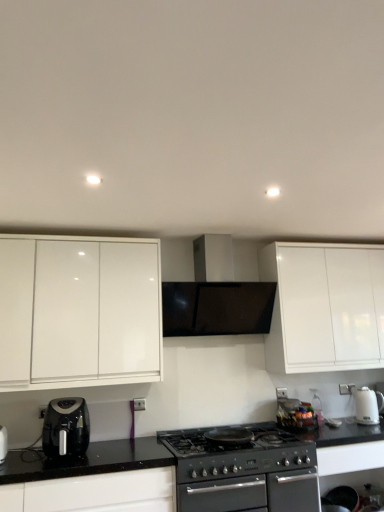
What do you see at coordinates (367, 405) in the screenshot?
I see `white glossy electric kettle at right, which ranks as the first kitchen appliance in back-to-front order` at bounding box center [367, 405].

Identify the location of black plastic air fryer at lower left, marked as the first kitchen appliance in a front-to-back arrangement. The image size is (384, 512). (66, 426).

The height and width of the screenshot is (512, 384). I want to click on black granite countertop at lower left, so click(x=86, y=460).

What do you see at coordinates (215, 298) in the screenshot?
I see `black matte range hood at center` at bounding box center [215, 298].

The width and height of the screenshot is (384, 512). Identify the location of white glossy cabinet at left. (79, 312).

From a real-world perspective, who is located lower, white glossy cabinet at left or black matte stove at center?

black matte stove at center, from a real-world perspective.

Is white glossy cabinet at left positioned beyond the bounds of black matte stove at center?

Absolutely, white glossy cabinet at left is external to black matte stove at center.

Considering the relative positions of white glossy cabinet at left and black matte stove at center in the image provided, is white glossy cabinet at left to the left of black matte stove at center from the viewer's perspective?

Indeed, white glossy cabinet at left is positioned on the left side of black matte stove at center.

Is black matte range hood at center completely or partially outside of white glossy cabinet at left?

Yes, black matte range hood at center is outside of white glossy cabinet at left.

In the scene shown: From the image's perspective, is black matte range hood at center on white glossy cabinet at left?

Yes, from the image's perspective, black matte range hood at center is on top of white glossy cabinet at left.

Are black matte range hood at center and white glossy cabinet at left located far from each other?

No.

How far apart are black matte range hood at center and white glossy cabinet at left?

black matte range hood at center is 23.02 inches from white glossy cabinet at left.

Considering the positions of objects white glossy cabinet at left and black plastic air fryer at lower left, placed as the 1th kitchen appliance when sorted from left to right, in the image provided, who is more to the left, white glossy cabinet at left or black plastic air fryer at lower left, placed as the 1th kitchen appliance when sorted from left to right,?

From the viewer's perspective, white glossy cabinet at left appears more on the left side.

Does white glossy cabinet at left touch black plastic air fryer at lower left, placed as the 1th kitchen appliance when sorted from left to right?

white glossy cabinet at left and black plastic air fryer at lower left, placed as the 1th kitchen appliance when sorted from left to right, are clearly separated.

How many degrees apart are the facing directions of white glossy cabinet at left and black plastic air fryer at lower left, positioned as the second kitchen appliance in right-to-left order?

The facing directions of white glossy cabinet at left and black plastic air fryer at lower left, positioned as the second kitchen appliance in right-to-left order, are 0.232 degrees apart.

Is white glossy cabinet at left aimed at black plastic air fryer at lower left, placed as the 1th kitchen appliance when sorted from left to right?

No, white glossy cabinet at left is not aimed at black plastic air fryer at lower left, placed as the 1th kitchen appliance when sorted from left to right.

Is black matte range hood at center facing towards black granite countertop at lower left?

No, black matte range hood at center does not turn towards black granite countertop at lower left.

Measure the distance from black matte range hood at center to black granite countertop at lower left.

black matte range hood at center and black granite countertop at lower left are 1.06 meters apart.

Is black matte range hood at center spatially inside black granite countertop at lower left, or outside of it?

black matte range hood at center is located beyond the bounds of black granite countertop at lower left.

Are black matte range hood at center and black granite countertop at lower left far apart?

Yes, black matte range hood at center and black granite countertop at lower left are located far from each other.

From the image's perspective, is black matte stove at center above or below black granite countertop at lower left?

black matte stove at center is situated lower than black granite countertop at lower left in the image.

Locate an element on the screen. The height and width of the screenshot is (512, 384). counter top lying on the left of black matte stove at center is located at coordinates (86, 460).

How much distance is there between black matte stove at center and black granite countertop at lower left?

A distance of 18.81 inches exists between black matte stove at center and black granite countertop at lower left.

Consider the image. Is black matte stove at center in front of or behind black granite countertop at lower left in the image?

black matte stove at center is behind black granite countertop at lower left.

Is black plastic air fryer at lower left, the 2th kitchen appliance in the back-to-front sequence, positioned with its back to black matte range hood at center?

No, black matte range hood at center is not at the back of black plastic air fryer at lower left, the 2th kitchen appliance in the back-to-front sequence.

Is black plastic air fryer at lower left, the 2th kitchen appliance in the back-to-front sequence, surrounding black matte range hood at center?

No, black plastic air fryer at lower left, the 2th kitchen appliance in the back-to-front sequence, does not contain black matte range hood at center.

Which object is thinner, black plastic air fryer at lower left, positioned as the second kitchen appliance in right-to-left order, or black matte range hood at center?

black plastic air fryer at lower left, positioned as the second kitchen appliance in right-to-left order, is thinner.

Does black plastic air fryer at lower left, placed as the 1th kitchen appliance when sorted from left to right, come behind black matte range hood at center?

No, black plastic air fryer at lower left, placed as the 1th kitchen appliance when sorted from left to right, is closer to the camera.

Is black granite countertop at lower left taller or shorter than white glossy electric kettle at right, the second kitchen appliance viewed from the front?

Clearly, black granite countertop at lower left is taller compared to white glossy electric kettle at right, the second kitchen appliance viewed from the front.

Which object is closer to the camera, black granite countertop at lower left or white glossy electric kettle at right, which ranks as the 1th kitchen appliance in right-to-left order?

Positioned in front is black granite countertop at lower left.

Locate an element on the screen. This screenshot has height=512, width=384. cabinetry located above the black matte stove at center (from a real-world perspective) is located at coordinates (79, 312).

Locate an element on the screen. home appliance to the right of white glossy cabinet at left is located at coordinates (215, 298).

Which object lies nearer to the anchor point black granite countertop at lower left, black matte range hood at center or white glossy electric kettle at right, which ranks as the first kitchen appliance in back-to-front order?

Among the two, black matte range hood at center is located nearer to black granite countertop at lower left.

Which object lies nearer to the anchor point black plastic air fryer at lower left, positioned as the second kitchen appliance in right-to-left order, white glossy electric kettle at right, the second kitchen appliance viewed from the front, or black matte range hood at center?

black matte range hood at center is closer to black plastic air fryer at lower left, positioned as the second kitchen appliance in right-to-left order.

Which object lies further to the anchor point white glossy cabinet at left, black plastic air fryer at lower left, positioned as the second kitchen appliance in right-to-left order, or white glossy electric kettle at right, the second kitchen appliance viewed from the front?

white glossy electric kettle at right, the second kitchen appliance viewed from the front, is positioned further to the anchor white glossy cabinet at left.

Considering their positions, is black granite countertop at lower left positioned further to black matte stove at center than white glossy electric kettle at right, the second kitchen appliance viewed from the front?

The object further to black matte stove at center is white glossy electric kettle at right, the second kitchen appliance viewed from the front.

Estimate the real-world distances between objects in this image. Which object is further from white glossy electric kettle at right, which ranks as the first kitchen appliance in back-to-front order, black plastic air fryer at lower left, positioned as the second kitchen appliance in right-to-left order, or black granite countertop at lower left?

black plastic air fryer at lower left, positioned as the second kitchen appliance in right-to-left order, is further to white glossy electric kettle at right, which ranks as the first kitchen appliance in back-to-front order.

When comparing their distances from white glossy cabinet at left, does black plastic air fryer at lower left, marked as the first kitchen appliance in a front-to-back arrangement, or black granite countertop at lower left seem further?

Among the two, black granite countertop at lower left is located further to white glossy cabinet at left.

Considering their positions, is white glossy cabinet at left positioned further to white glossy electric kettle at right, which ranks as the first kitchen appliance in back-to-front order, than black matte range hood at center?

Based on the image, white glossy cabinet at left appears to be further to white glossy electric kettle at right, which ranks as the first kitchen appliance in back-to-front order.

Considering their positions, is black matte range hood at center positioned further to white glossy cabinet at left than black granite countertop at lower left?

black granite countertop at lower left lies further to white glossy cabinet at left than the other object.

Locate an element on the screen. The height and width of the screenshot is (512, 384). cabinetry between black matte range hood at center and black matte stove at center in the vertical direction is located at coordinates (79, 312).

The image size is (384, 512). In order to click on home appliance located between white glossy cabinet at left and white glossy electric kettle at right, placed as the 2th kitchen appliance when sorted from left to right, in the left-right direction in this screenshot , I will do `click(215, 298)`.

At what (x,y) coordinates should I click in order to perform the action: click on appliance between white glossy cabinet at left and white glossy electric kettle at right, placed as the 2th kitchen appliance when sorted from left to right, from left to right. Please return your answer as a coordinate pair (x, y). Looking at the image, I should click on (244, 471).

Where is `counter top between white glossy cabinet at left and black matte stove at center in the up-down direction`? counter top between white glossy cabinet at left and black matte stove at center in the up-down direction is located at coordinates (86, 460).